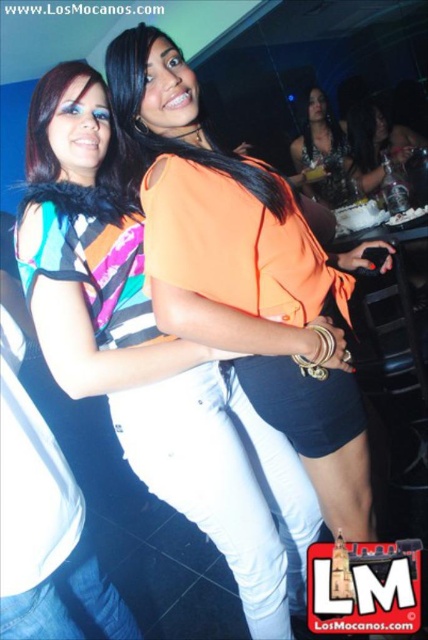
Question: Is matte orange shirt at center positioned at the back of satin black dress at center?

Choices:
 (A) no
 (B) yes

Answer: (A)

Question: Which object is positioned farthest from the satin black dress at center?

Choices:
 (A) matte orange top at center
 (B) matte orange shirt at center

Answer: (B)

Question: Among these points, which one is farthest from the camera?

Choices:
 (A) (332, 141)
 (B) (380, 144)
 (C) (134, 403)

Answer: (A)

Question: Which of the following is the closest to the observer?

Choices:
 (A) (332, 152)
 (B) (363, 100)
 (C) (291, 600)

Answer: (C)

Question: Observing the image, what is the correct spatial positioning of matte orange shirt at center in reference to satin black dress at center?

Choices:
 (A) below
 (B) above

Answer: (A)

Question: Is matte orange top at center further to camera compared to satin black dress at center?

Choices:
 (A) yes
 (B) no

Answer: (B)